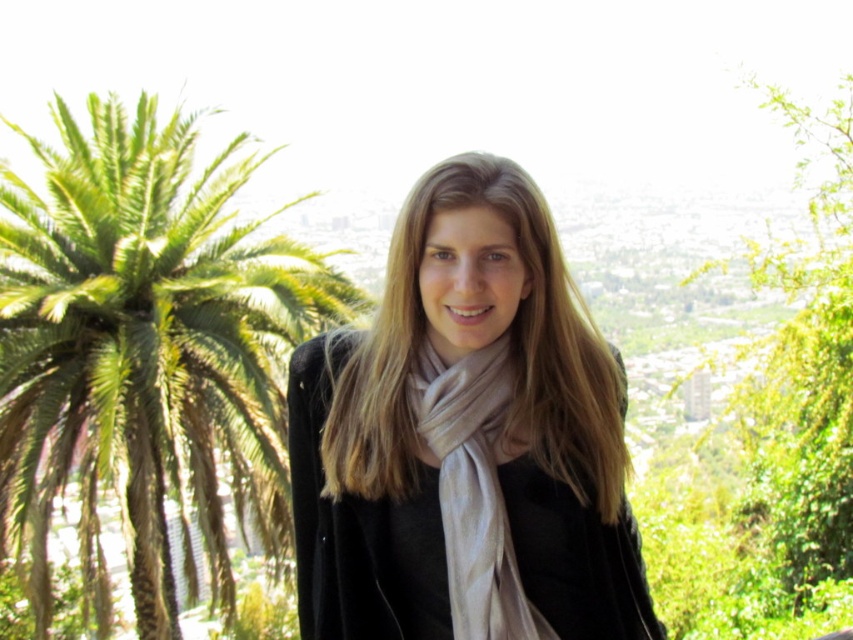
Based on the coordinates provided in the scene description, where is the green leafy palm tree at left located?

The green leafy palm tree at left is located at point 0.545 on the x axis and 0.171 on the y axis.

You are a fashion stylist helping someone choose between two scarves. The person is wearing both the matte black scarf at center and the beige silk scarf at center. Which scarf is visible on top?

The matte black scarf at center is positioned over the beige silk scarf at center, so it is visible on top.